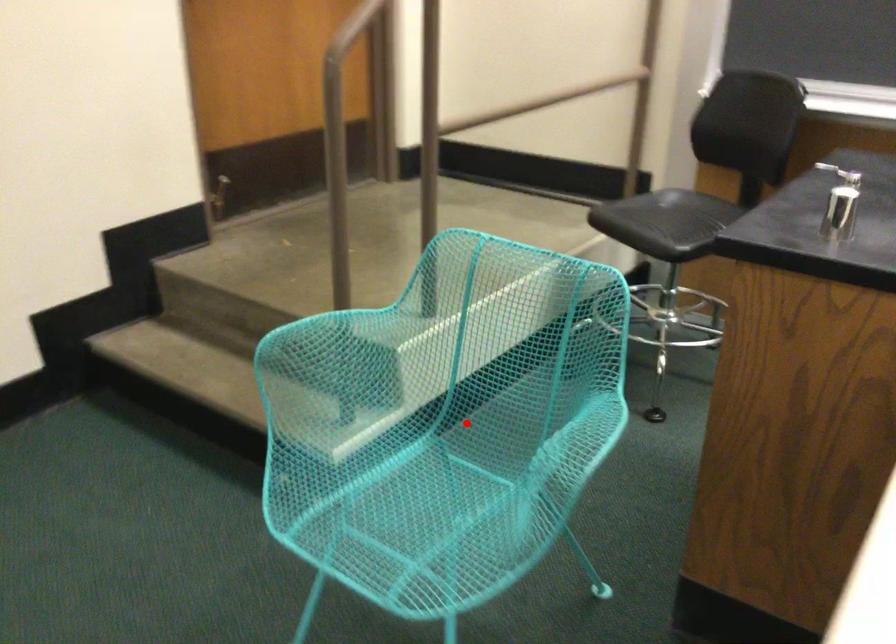
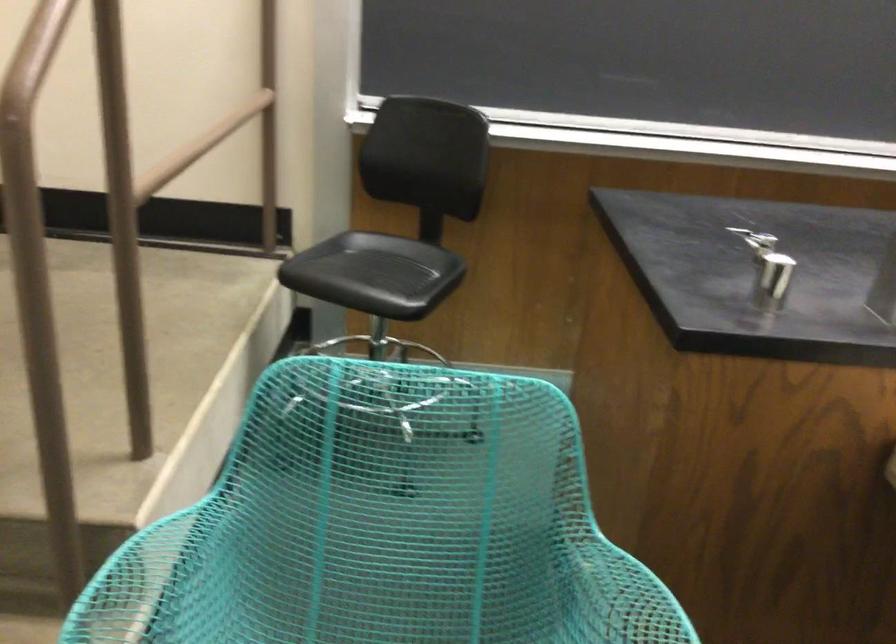
Question: I am providing you with two images of the same scene from different viewpoints. A red point is shown in image1. For the corresponding object point in image2, is it positioned nearer or farther from the camera?

Choices:
 (A) Nearer
 (B) Farther

Answer: (A)